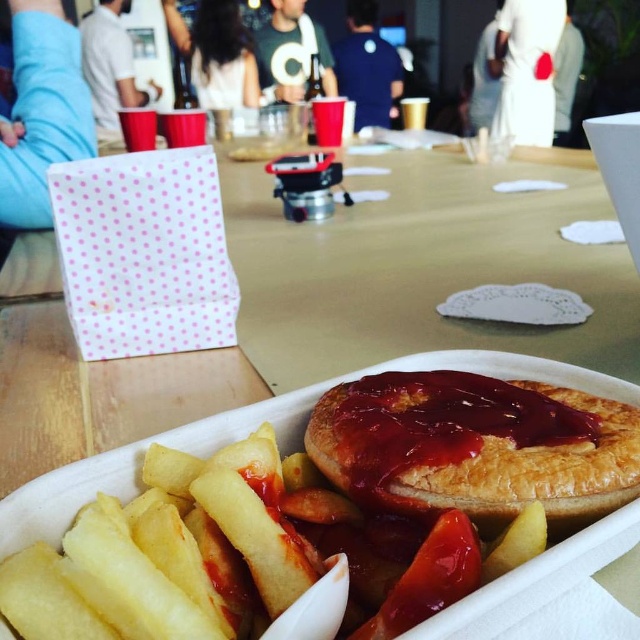
Question: Which object is closer to the camera taking this photo?

Choices:
 (A) golden flaky pie at center
 (B) golden crispy french fries at lower left

Answer: (B)

Question: Does golden crispy french fries at lower left appear on the left side of golden flaky pie at center?

Choices:
 (A) no
 (B) yes

Answer: (B)

Question: Is golden crispy french fries at lower left to the right of golden flaky pie at center from the viewer's perspective?

Choices:
 (A) no
 (B) yes

Answer: (A)

Question: Which of the following is the closest to the observer?

Choices:
 (A) (61, 609)
 (B) (632, 474)

Answer: (A)

Question: Is golden crispy french fries at lower left positioned at the back of golden flaky pie at center?

Choices:
 (A) no
 (B) yes

Answer: (A)